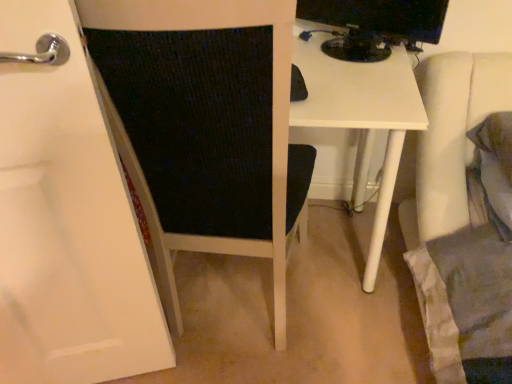
Where is `black fabric chair at left`? black fabric chair at left is located at coordinates (204, 126).

Image resolution: width=512 pixels, height=384 pixels. Describe the element at coordinates (204, 126) in the screenshot. I see `black fabric chair at left` at that location.

What do you see at coordinates (375, 25) in the screenshot?
I see `black glossy monitor at upper right` at bounding box center [375, 25].

Locate an element on the screen. The width and height of the screenshot is (512, 384). black glossy monitor at upper right is located at coordinates (375, 25).

I want to click on black fabric chair at left, so [204, 126].

Considering the positions of objects black glossy monitor at upper right and black fabric chair at left in the image provided, who is more to the left, black glossy monitor at upper right or black fabric chair at left?

black fabric chair at left is more to the left.

Does black glossy monitor at upper right come behind black fabric chair at left?

Yes, black glossy monitor at upper right is further from the camera.

Between point (434, 28) and point (278, 81), which one is positioned in front?

The point (278, 81) is closer to the camera.

From the image's perspective, is black glossy monitor at upper right located beneath black fabric chair at left?

Incorrect, from the image's perspective, black glossy monitor at upper right is higher than black fabric chair at left.

From a real-world perspective, is black glossy monitor at upper right on top of black fabric chair at left?

Correct, in the physical world, black glossy monitor at upper right is higher than black fabric chair at left.

Can you confirm if black glossy monitor at upper right is wider than black fabric chair at left?

In fact, black glossy monitor at upper right might be narrower than black fabric chair at left.

From their relative heights in the image, would you say black glossy monitor at upper right is taller or shorter than black fabric chair at left?

Considering their sizes, black glossy monitor at upper right has less height than black fabric chair at left.

Which of these two, black glossy monitor at upper right or black fabric chair at left, is smaller?

black glossy monitor at upper right.

Is black glossy monitor at upper right not inside black fabric chair at left?

Yes, black glossy monitor at upper right is located beyond the bounds of black fabric chair at left.

Are black glossy monitor at upper right and black fabric chair at left beside each other?

black glossy monitor at upper right and black fabric chair at left are not in contact.

Is black glossy monitor at upper right oriented towards black fabric chair at left?

No, black glossy monitor at upper right is not facing towards black fabric chair at left.

Locate an element on the screen. desktop computer that appears behind the black fabric chair at left is located at coordinates (375, 25).

Which object is positioned more to the left, black fabric chair at left or black glossy monitor at upper right?

Positioned to the left is black fabric chair at left.

Between black fabric chair at left and black glossy monitor at upper right, which one is positioned in front?

→ black fabric chair at left.

Does point (190, 212) appear closer or farther from the camera than point (344, 18)?

Point (190, 212) appears to be closer to the viewer than point (344, 18).

From the image's perspective, which is below, black fabric chair at left or black glossy monitor at upper right?

black fabric chair at left, from the image's perspective.

Consider the image. From a real-world perspective, which is physically below, black fabric chair at left or black glossy monitor at upper right?

black fabric chair at left is physically lower.

Which of these two, black fabric chair at left or black glossy monitor at upper right, is wider?

black fabric chair at left is wider.

Considering the sizes of black fabric chair at left and black glossy monitor at upper right in the image, is black fabric chair at left taller or shorter than black glossy monitor at upper right?

In the image, black fabric chair at left appears to be taller than black glossy monitor at upper right.

In terms of size, does black fabric chair at left appear bigger or smaller than black glossy monitor at upper right?

Clearly, black fabric chair at left is larger in size than black glossy monitor at upper right.

Which is correct: black fabric chair at left is inside black glossy monitor at upper right, or outside of it?

black fabric chair at left cannot be found inside black glossy monitor at upper right.

Are black fabric chair at left and black glossy monitor at upper right far apart?

No, black fabric chair at left is in close proximity to black glossy monitor at upper right.

Is black fabric chair at left oriented away from black glossy monitor at upper right?

No.

Can you tell me how much black fabric chair at left and black glossy monitor at upper right differ in facing direction?

The facing directions of black fabric chair at left and black glossy monitor at upper right are 29.2 degrees apart.

Based on the photo, how far apart are black fabric chair at left and black glossy monitor at upper right?

A distance of 22.95 inches exists between black fabric chair at left and black glossy monitor at upper right.

This screenshot has width=512, height=384. Identify the location of furniture in front of the black glossy monitor at upper right. (204, 126).

I want to click on desktop computer on the right of black fabric chair at left, so click(x=375, y=25).

Where is `desktop computer that appears above the black fabric chair at left (from a real-world perspective)`? The height and width of the screenshot is (384, 512). desktop computer that appears above the black fabric chair at left (from a real-world perspective) is located at coordinates pos(375,25).